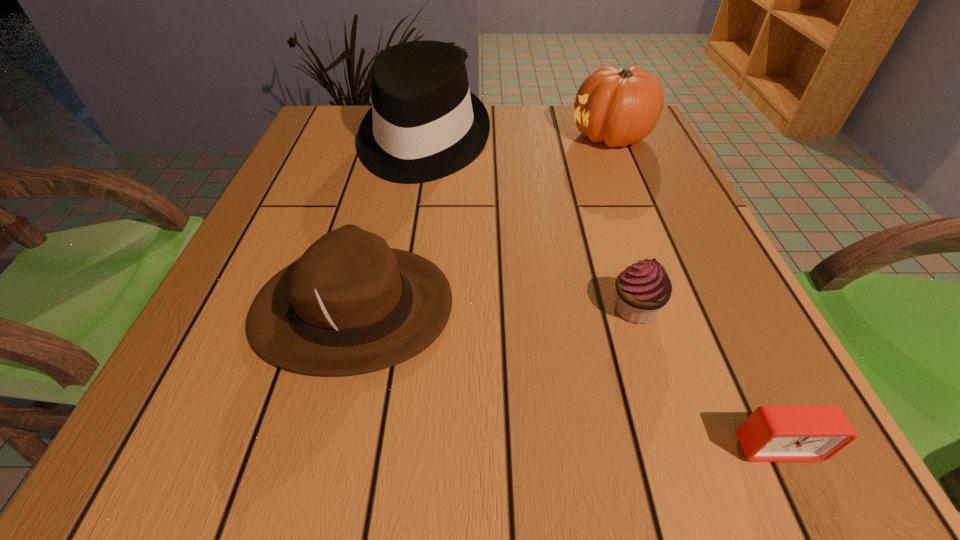
I want to click on the farther fedora, so click(x=424, y=124).

The width and height of the screenshot is (960, 540). Identify the location of pumpkin. (621, 106).

This screenshot has height=540, width=960. Find the location of `the shorter fedora`. the shorter fedora is located at coordinates (350, 305).

Locate an element on the screen. This screenshot has height=540, width=960. the second shortest object is located at coordinates (644, 288).

The image size is (960, 540). Find the location of `the shortest object`. the shortest object is located at coordinates (772, 433).

Locate an element on the screen. alarm clock is located at coordinates (772, 433).

Identify the location of blank space located on the right of the taller fedora. The width and height of the screenshot is (960, 540). (644, 141).

Where is `blank area located 0.210m on the carved face of the pumpkin`? The height and width of the screenshot is (540, 960). blank area located 0.210m on the carved face of the pumpkin is located at coordinates (484, 137).

This screenshot has width=960, height=540. Identify the location of vacant space situated on the carved face of the pumpkin. (468, 137).

Where is `vacant area situated 0.080m on the carved face of the pumpkin`? vacant area situated 0.080m on the carved face of the pumpkin is located at coordinates (537, 137).